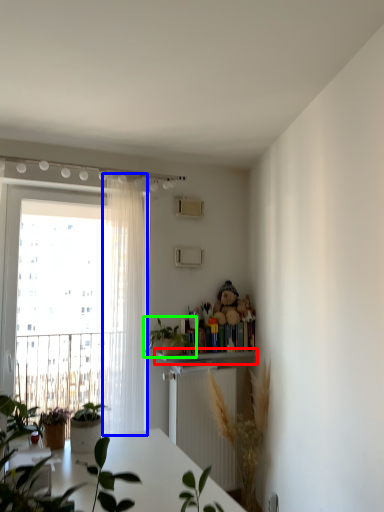
Question: Considering the real-world distances, which object is closest to shelf (highlighted by a red box)? curtain (highlighted by a blue box) or houseplant (highlighted by a green box).

Choices:
 (A) curtain
 (B) houseplant

Answer: (B)